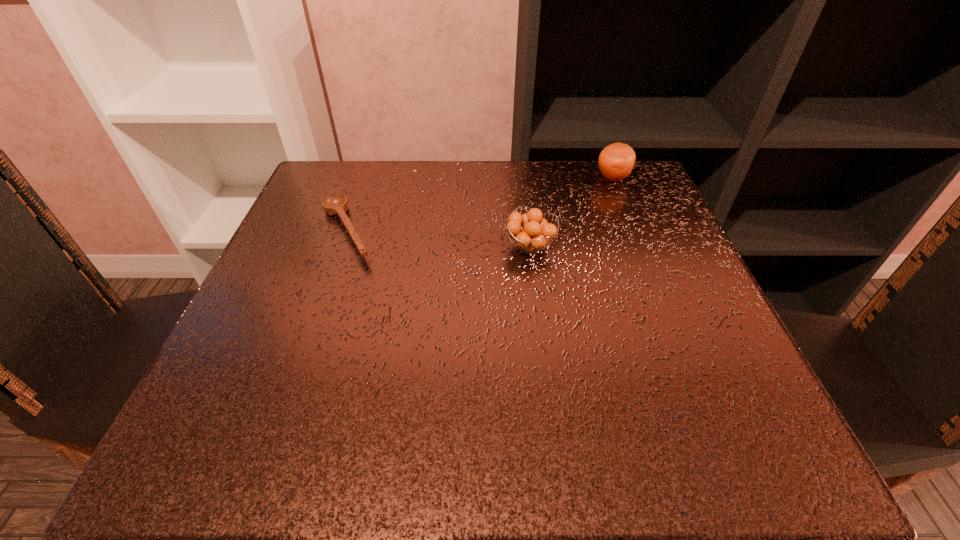
Find the location of a particular element. The width and height of the screenshot is (960, 540). the right orange fruit is located at coordinates (616, 161).

Locate an element on the screen. the farthest object is located at coordinates [x=616, y=161].

The image size is (960, 540). I want to click on the left orange fruit, so click(x=537, y=232).

In order to click on the shorter orange fruit in this screenshot , I will do `click(537, 232)`.

Where is `wooden spoon`? wooden spoon is located at coordinates (335, 204).

Where is `the shortest object`? The width and height of the screenshot is (960, 540). the shortest object is located at coordinates (335, 204).

Find the location of a particular element. vacant region located 0.200m on the front of the farthest object is located at coordinates (639, 244).

This screenshot has width=960, height=540. Identify the location of vacant area situated on the left of the left orange fruit. (477, 246).

You are a GUI agent. You are given a task and a screenshot of the screen. Output one action in this format:
    pyautogui.click(x=<x>, y=<y>)
    Task: Click on the vacant space positioned on the front of the shortest object
    The width and height of the screenshot is (960, 540).
    Given the screenshot: What is the action you would take?
    pyautogui.click(x=265, y=467)

Where is `orange that is at the far edge`? Image resolution: width=960 pixels, height=540 pixels. orange that is at the far edge is located at coordinates (616, 161).